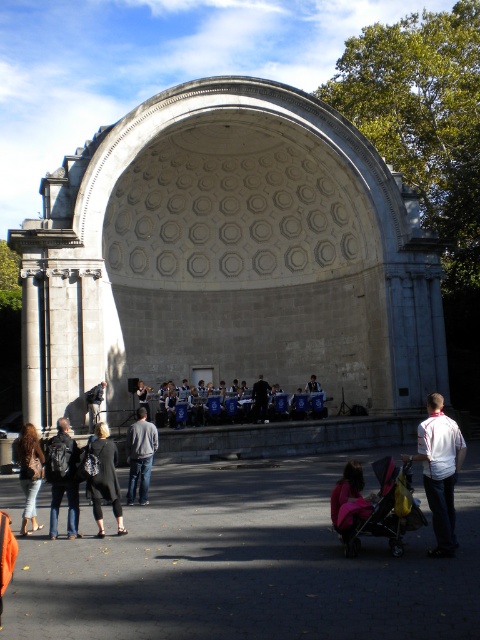
Question: Which of the following is the farthest from the observer?

Choices:
 (A) brown leather jacket at lower left
 (B) gray stone amphitheater at center
 (C) yellow fabric baby carriage at lower center
 (D) black leather jacket at center

Answer: (B)

Question: Observing the image, what is the correct spatial positioning of black leather jacket at center in reference to pink fabric stroller at lower center?

Choices:
 (A) right
 (B) left

Answer: (B)

Question: Is the position of pink fabric stroller at lower center less distant than that of black fabric at center?

Choices:
 (A) no
 (B) yes

Answer: (B)

Question: Which point appears farthest from the camera in this image?

Choices:
 (A) (259, 412)
 (B) (192, 403)

Answer: (B)

Question: Which object is positioned farthest from the white cotton shirt at lower right?

Choices:
 (A) brown leather jacket at lower left
 (B) black fabric at center
 (C) dark brown leather jacket at lower left
 (D) pink fabric stroller at lower center

Answer: (A)

Question: Is white cotton shirt at lower right to the left of black fabric at center from the viewer's perspective?

Choices:
 (A) yes
 (B) no

Answer: (B)